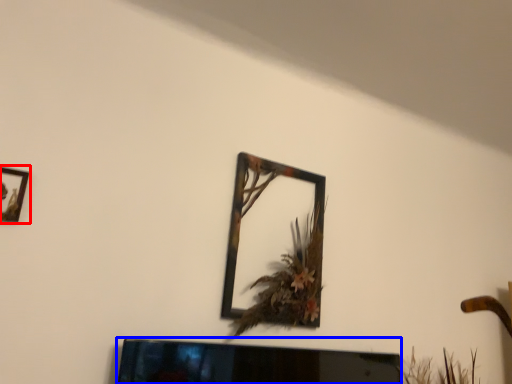
Question: Which object is closer to the camera taking this photo, picture frame (highlighted by a red box) or television (highlighted by a blue box)?

Choices:
 (A) picture frame
 (B) television

Answer: (A)